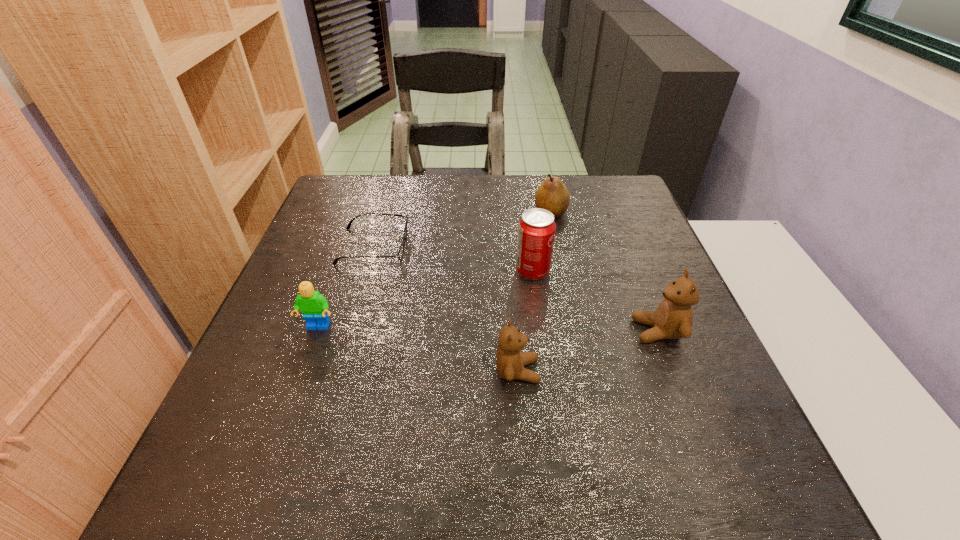
Please point a free position for a teddy bear on the left. Please provide its 2D coordinates. Your answer should be formatted as a tuple, i.e. [(x, y)], where the tuple contains the x and y coordinates of a point satisfying the conditions above.

[(349, 419)]